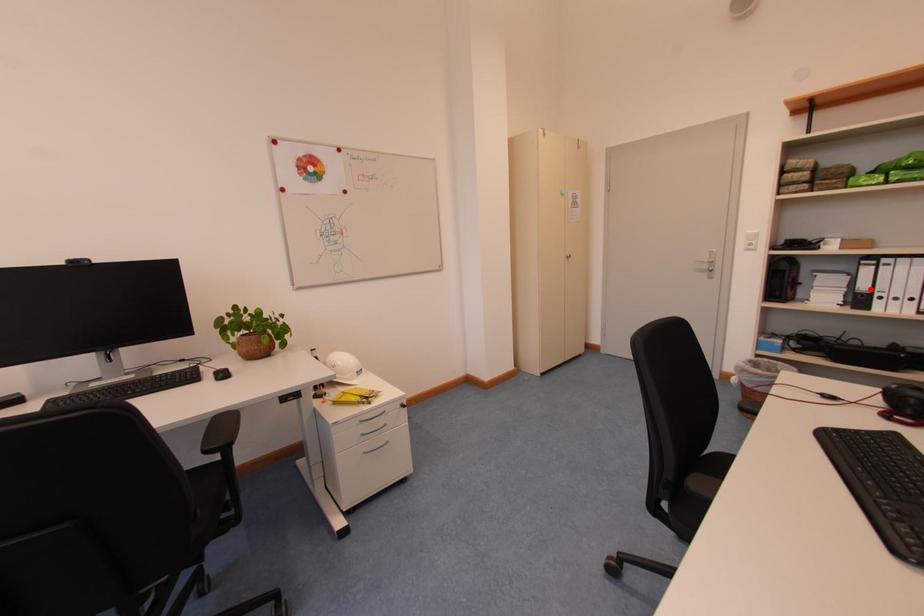
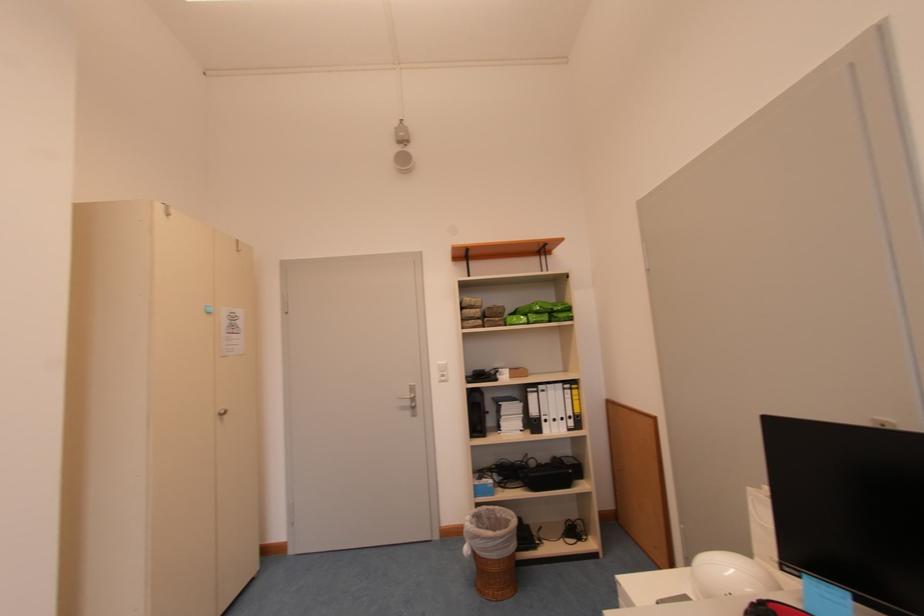
Where in the second image is the point corresponding to the highlighted location from the first image?

(541, 415)